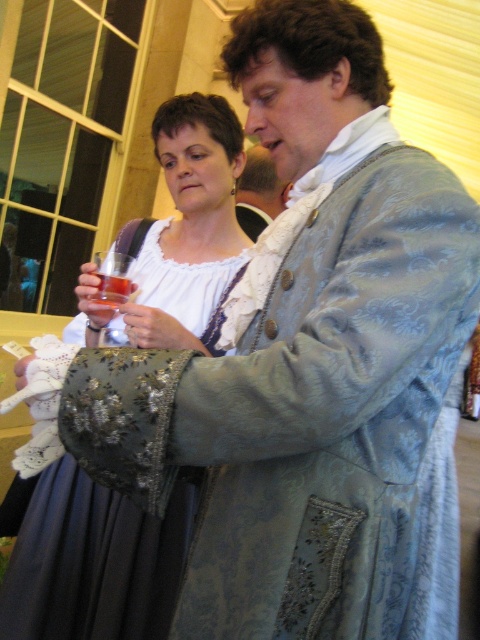
Question: Which of the following is the closest to the observer?

Choices:
 (A) translucent glass at upper left
 (B) matte white lace dress at center
 (C) silvery brocade coat at upper center
 (D) transparent glass at upper left

Answer: (D)

Question: Considering the real-world distances, which object is farthest from the silvery brocade coat at upper center?

Choices:
 (A) transparent glass at upper left
 (B) translucent glass at upper left

Answer: (B)

Question: Which point is farther from the camera taking this photo?

Choices:
 (A) (265, 182)
 (B) (96, 253)

Answer: (A)

Question: Is transparent glass at upper left wider than translucent glass at upper left?

Choices:
 (A) no
 (B) yes

Answer: (B)

Question: Is the position of matte white lace dress at center less distant than that of translucent glass at upper left?

Choices:
 (A) yes
 (B) no

Answer: (B)

Question: Is matte white lace dress at center bigger than translucent glass at upper left?

Choices:
 (A) yes
 (B) no

Answer: (A)